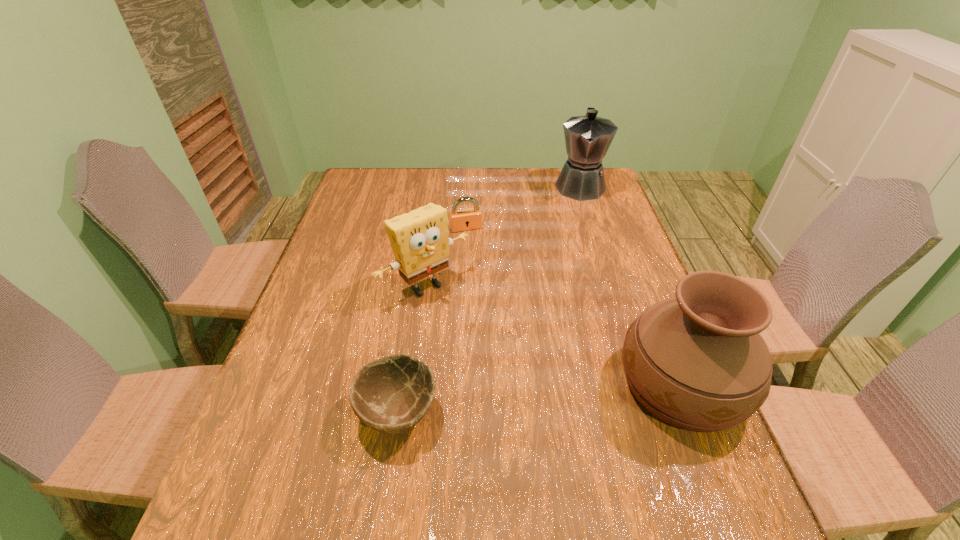
Find the location of `the shortest object`. the shortest object is located at coordinates (391, 394).

This screenshot has width=960, height=540. Identify the location of urn. (697, 362).

This screenshot has width=960, height=540. Find the location of `coffeepot`. coffeepot is located at coordinates (588, 138).

Locate an element on the screen. The width and height of the screenshot is (960, 540). padlock is located at coordinates (469, 219).

Where is `the second shortest object`? The height and width of the screenshot is (540, 960). the second shortest object is located at coordinates (469, 219).

The width and height of the screenshot is (960, 540). Identify the location of sponge. (419, 239).

Find the location of a particular element. This screenshot has width=960, height=540. vacant position located 0.330m on the right of the shortest object is located at coordinates (598, 413).

You are a GUI agent. You are given a task and a screenshot of the screen. Output one action in this format:
    pyautogui.click(x=<x>, y=<y>)
    Task: Click on the vacant region located 0.060m on the back of the urn
    
    Given the screenshot: What is the action you would take?
    pyautogui.click(x=655, y=316)

The image size is (960, 540). I want to click on free space located at the spout of the farthest object, so pyautogui.click(x=580, y=219).

This screenshot has height=540, width=960. Find the location of `free region located at the spout of the farthest object`. free region located at the spout of the farthest object is located at coordinates (578, 274).